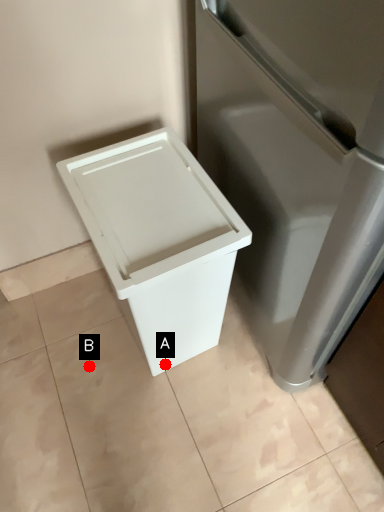
Question: Two points are circled on the image, labeled by A and B beside each circle. Which point appears closest to the camera in this image?

Choices:
 (A) A is closer
 (B) B is closer

Answer: (A)